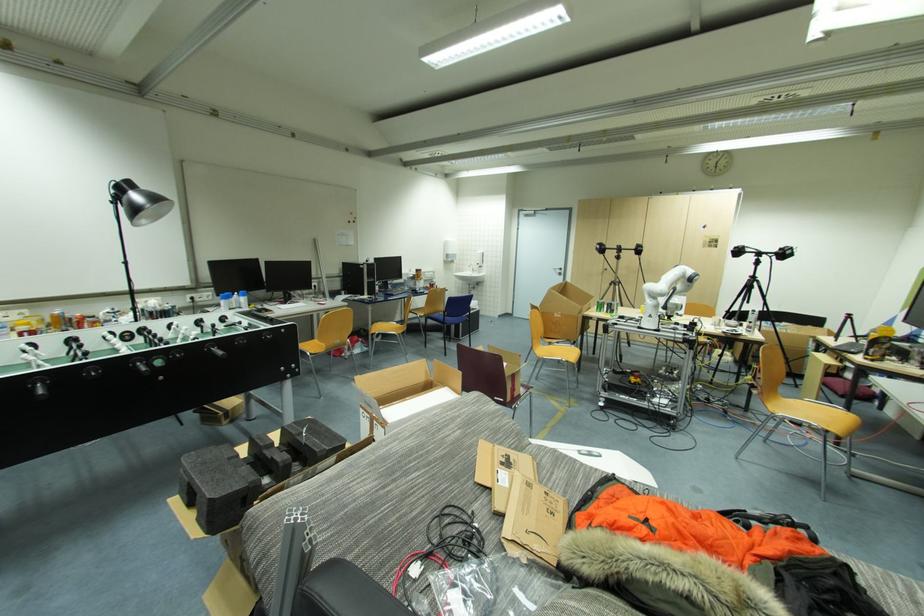
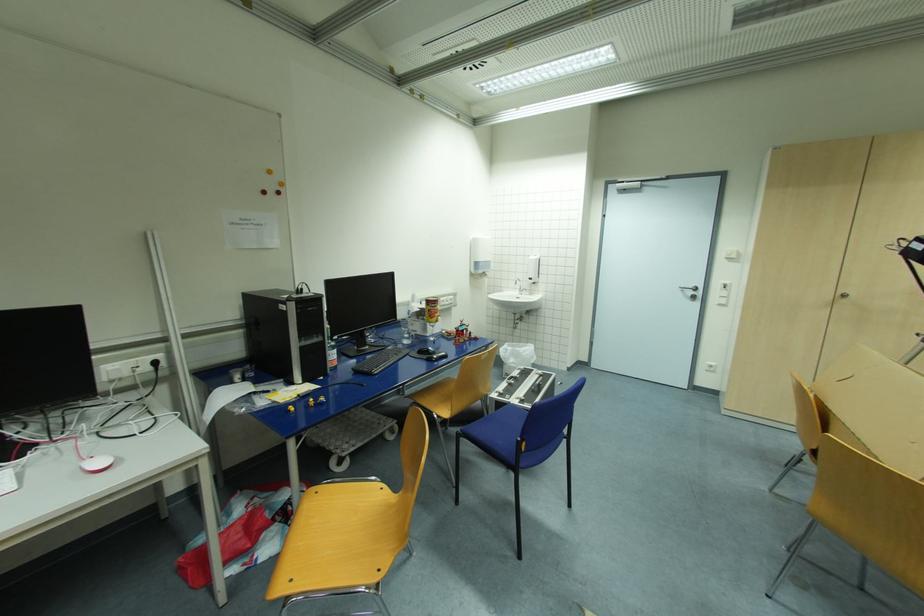
In the second image, find the point that corresponds to (x=481, y=265) in the first image.

(533, 280)